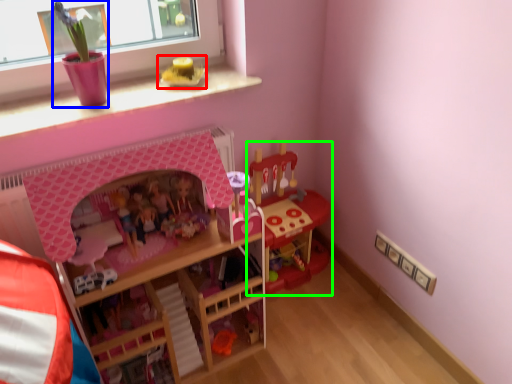
Question: Which object is the closest to the toy (highlighted by a red box)? Choose among these: toy (highlighted by a blue box) or toy (highlighted by a green box).

Choices:
 (A) toy
 (B) toy

Answer: (A)